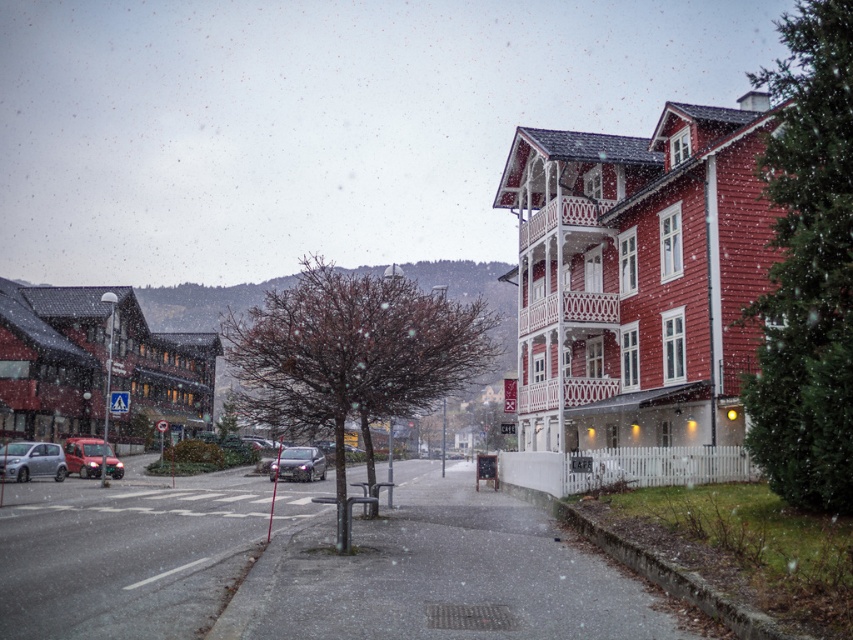
Consider the image. Does matte red building at left have a lesser width compared to satin silver car at center?

Incorrect, matte red building at left's width is not less than satin silver car at center's.

Is matte red building at left smaller than satin silver car at center?

Actually, matte red building at left might be larger than satin silver car at center.

Describe the element at coordinates (96, 364) in the screenshot. The image size is (853, 640). I see `matte red building at left` at that location.

Where is `matte red building at left`? The height and width of the screenshot is (640, 853). matte red building at left is located at coordinates (96, 364).

Which is more to the right, matte red wooden house at right or satin silver car at lower left?

Positioned to the right is matte red wooden house at right.

Is the position of matte red wooden house at right more distant than that of satin silver car at lower left?

No, it is in front of satin silver car at lower left.

Does point (579, 225) come farther from viewer compared to point (38, 467)?

No, (579, 225) is in front of (38, 467).

Find the location of a particular element. This screenshot has width=853, height=640. matte red wooden house at right is located at coordinates (639, 282).

Which is above, matte red wooden house at right or metallic red van at lower left?

matte red wooden house at right is higher up.

Can you confirm if matte red wooden house at right is positioned to the left of metallic red van at lower left?

Incorrect, matte red wooden house at right is not on the left side of metallic red van at lower left.

Does point (614, 476) come closer to viewer compared to point (109, 461)?

Yes, it is in front of point (109, 461).

Where is `matte red wooden house at right`? The image size is (853, 640). matte red wooden house at right is located at coordinates (639, 282).